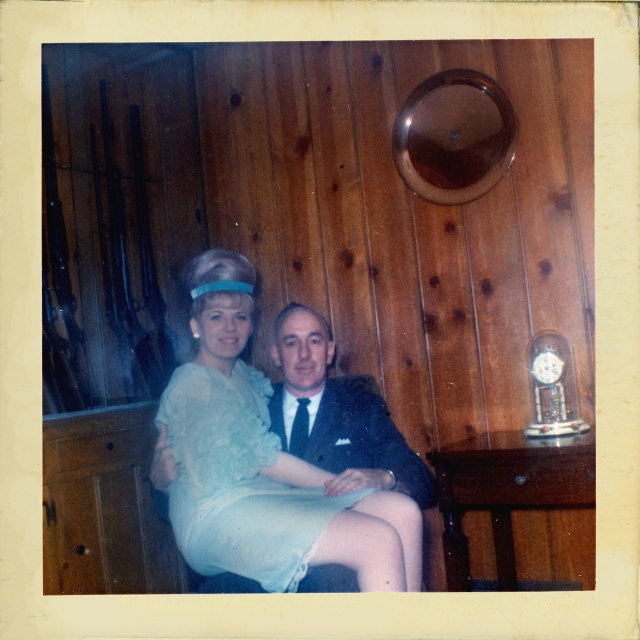
Question: Among these objects, which one is farthest from the camera?

Choices:
 (A) light blue lace dress at center
 (B) dark blue suit at center

Answer: (B)

Question: Considering the relative positions of light blue lace dress at center and dark blue suit at center in the image provided, where is light blue lace dress at center located with respect to dark blue suit at center?

Choices:
 (A) above
 (B) below

Answer: (B)

Question: Does light blue lace dress at center appear on the right side of dark blue suit at center?

Choices:
 (A) yes
 (B) no

Answer: (B)

Question: Is light blue lace dress at center above dark blue suit at center?

Choices:
 (A) yes
 (B) no

Answer: (B)